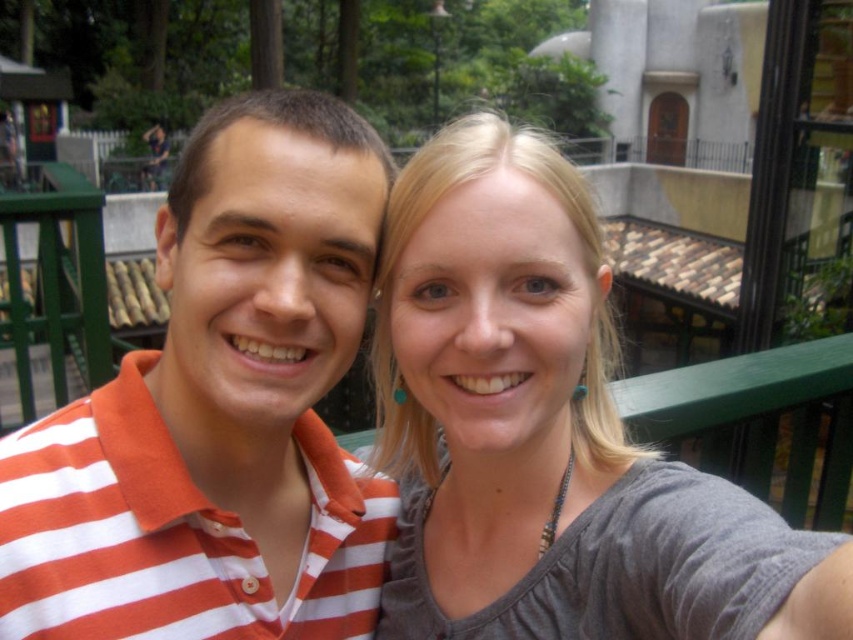
You are taking a photo of two people standing side by side. You notice the orange striped shirt at center and the gray fabric shirt at center. Which shirt is positioned closer to the left side of the photo?

The orange striped shirt at center is positioned to the left of the gray fabric shirt at center, so it is closer to the left side of the photo.

Looking at this image, you are taking a photo of two people standing on a balcony with a green railing. The orange striped shirt at center and the gray fabric shirt at center are both visible. Based on their positions, which shirt is higher in the image?

The orange striped shirt at center is above the gray fabric shirt at center, so the orange striped shirt at center appears higher in the image.